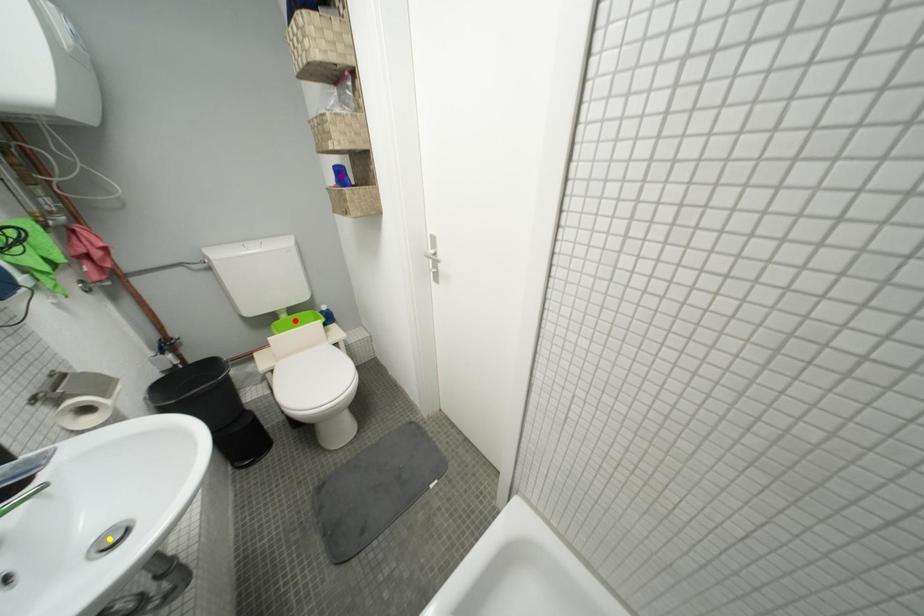
Order these from farthest to nearest:
- purple point
- red point
- yellow point

red point, purple point, yellow point